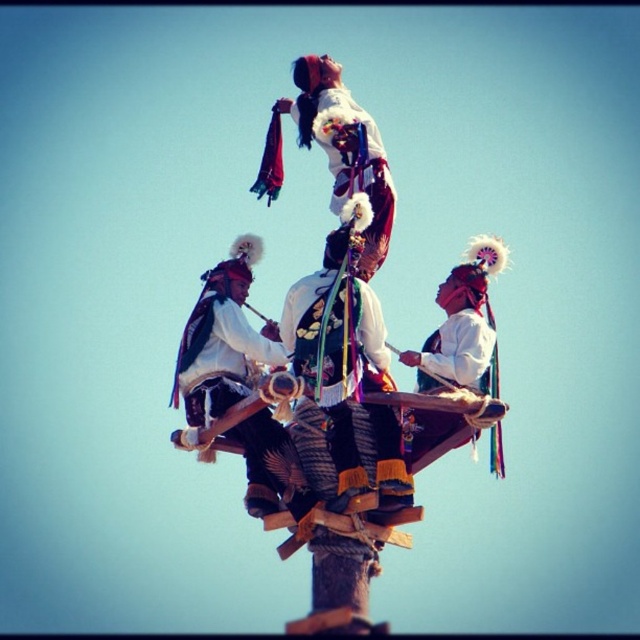
From the picture: Is white fabric costume at center wider than white matte fabric at center?

Incorrect, white fabric costume at center's width does not surpass white matte fabric at center's.

Which is in front, point (353, 404) or point (332, 77)?

Positioned in front is point (353, 404).

Is point (300, 372) behind point (337, 164)?

No, (300, 372) is in front of (337, 164).

This screenshot has height=640, width=640. I want to click on white fabric costume at center, so [346, 372].

Looking at this image, is white fabric costume at center thinner than white matte headdress at center?

Yes, white fabric costume at center is thinner than white matte headdress at center.

Which is behind, point (378, 451) or point (260, 420)?

Positioned behind is point (260, 420).

The height and width of the screenshot is (640, 640). I want to click on white fabric costume at center, so click(346, 372).

Is the position of white matte headdress at center more distant than that of white matte fabric at center?

No, white matte headdress at center is closer to the viewer.

Between white matte headdress at center and white matte fabric at center, which one has more height?

white matte headdress at center is taller.

Who is more distant from viewer, [230,259] or [365,144]?

The point [230,259] is behind.

You are a GUI agent. You are given a task and a screenshot of the screen. Output one action in this format:
    pyautogui.click(x=<x>, y=<y>)
    Task: Click on the white matte headdress at center
    Image resolution: width=640 pixels, height=640 pixels.
    Given the screenshot: What is the action you would take?
    pyautogui.click(x=221, y=340)